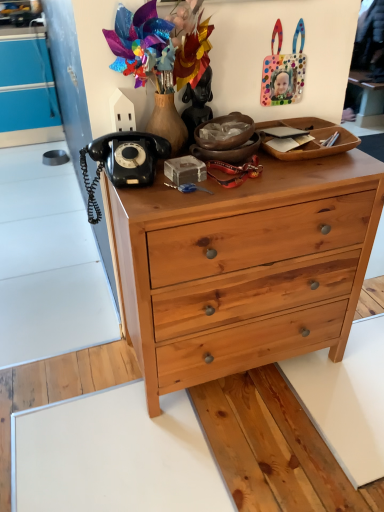
This screenshot has width=384, height=512. Identify the location of black matte statue at upper center. (198, 103).

This screenshot has width=384, height=512. What do you see at coordinates (244, 267) in the screenshot?
I see `natural wood chest of drawers at center` at bounding box center [244, 267].

At what (x,y) coordinates should I click in order to perform the action: click on black matte statue at upper center. Please return your answer as a coordinate pair (x, y). Looking at the image, I should click on (198, 103).

Considering the positions of objects polka dot plastic handbag at upper right and black rubberized telephone at upper left in the image provided, who is behind, polka dot plastic handbag at upper right or black rubberized telephone at upper left?

polka dot plastic handbag at upper right is further from the camera.

The width and height of the screenshot is (384, 512). Find the location of `handbag behind the black rubberized telephone at upper left`. handbag behind the black rubberized telephone at upper left is located at coordinates (283, 70).

From the image's perspective, is polka dot plastic handbag at upper right positioned above or below black rubberized telephone at upper left?

Clearly, from the image's perspective, polka dot plastic handbag at upper right is above black rubberized telephone at upper left.

Does polka dot plastic handbag at upper right have a smaller size compared to natural wood chest of drawers at center?

Yes, polka dot plastic handbag at upper right is smaller than natural wood chest of drawers at center.

Does polka dot plastic handbag at upper right have a greater width compared to natural wood chest of drawers at center?

No.

Is polka dot plastic handbag at upper right to the right of natural wood chest of drawers at center from the viewer's perspective?

Indeed, polka dot plastic handbag at upper right is positioned on the right side of natural wood chest of drawers at center.

Is natural wood chest of drawers at center completely or partially inside polka dot plastic handbag at upper right?

No, natural wood chest of drawers at center is not a part of polka dot plastic handbag at upper right.

Locate an element on the screen. This screenshot has width=384, height=512. person behind the natural wood chest of drawers at center is located at coordinates (198, 103).

From the picture: How many degrees apart are the facing directions of natural wood chest of drawers at center and black matte statue at upper center?

0.818 degrees separate the facing orientations of natural wood chest of drawers at center and black matte statue at upper center.

Which of these two, natural wood chest of drawers at center or black matte statue at upper center, is thinner?

Thinner between the two is black matte statue at upper center.

Considering the positions of objects natural wood chest of drawers at center and black matte statue at upper center in the image provided, who is more to the right, natural wood chest of drawers at center or black matte statue at upper center?

natural wood chest of drawers at center is more to the right.

Is black matte statue at upper center situated inside polka dot plastic handbag at upper right or outside?

black matte statue at upper center is spatially situated outside polka dot plastic handbag at upper right.

Considering the positions of points (190, 87) and (282, 76), is point (190, 87) farther from camera compared to point (282, 76)?

No.

Identify the location of person below the polka dot plastic handbag at upper right (from the image's perspective). (198, 103).

Which is more to the right, black matte statue at upper center or polka dot plastic handbag at upper right?

From the viewer's perspective, polka dot plastic handbag at upper right appears more on the right side.

From the picture: Is the surface of natural wood chest of drawers at center in direct contact with black rubberized telephone at upper left?

No.

From their relative heights in the image, would you say natural wood chest of drawers at center is taller or shorter than black rubberized telephone at upper left?

Considering their sizes, natural wood chest of drawers at center has more height than black rubberized telephone at upper left.

Which of these two, natural wood chest of drawers at center or black rubberized telephone at upper left, is bigger?

With larger size is natural wood chest of drawers at center.

Where is `corded phone above the natural wood chest of drawers at center (from the image's perspective)`? Image resolution: width=384 pixels, height=512 pixels. corded phone above the natural wood chest of drawers at center (from the image's perspective) is located at coordinates (122, 162).

Considering the sizes of objects black rubberized telephone at upper left and black matte statue at upper center in the image provided, who is thinner, black rubberized telephone at upper left or black matte statue at upper center?

With smaller width is black matte statue at upper center.

Locate an element on the screen. This screenshot has width=384, height=512. corded phone below the black matte statue at upper center (from a real-world perspective) is located at coordinates (122, 162).

Is black rubberized telephone at upper left positioned beyond the bounds of black matte statue at upper center?

That's correct, black rubberized telephone at upper left is outside of black matte statue at upper center.

Measure the distance between black rubberized telephone at upper left and black matte statue at upper center.

black rubberized telephone at upper left and black matte statue at upper center are 9.38 inches apart.

Is natural wood chest of drawers at center shorter than polka dot plastic handbag at upper right?

Incorrect, the height of natural wood chest of drawers at center does not fall short of that of polka dot plastic handbag at upper right.

Which object is positioned more to the right, natural wood chest of drawers at center or polka dot plastic handbag at upper right?

Positioned to the right is polka dot plastic handbag at upper right.

Is natural wood chest of drawers at center oriented away from polka dot plastic handbag at upper right?

No, natural wood chest of drawers at center is not facing away from polka dot plastic handbag at upper right.

Looking at this image, from the image's perspective, is natural wood chest of drawers at center located beneath polka dot plastic handbag at upper right?

Yes, from the image's perspective, natural wood chest of drawers at center is beneath polka dot plastic handbag at upper right.

What are the coordinates of `handbag behind the black rubberized telephone at upper left` in the screenshot? It's located at [x=283, y=70].

In the image, there is a natural wood chest of drawers at center. Identify the location of handbag above it (from the image's perspective). The width and height of the screenshot is (384, 512). (283, 70).

Looking at the image, which one is located closer to black rubberized telephone at upper left, polka dot plastic handbag at upper right or natural wood chest of drawers at center?

Among the two, natural wood chest of drawers at center is located nearer to black rubberized telephone at upper left.

Which object lies nearer to the anchor point black matte statue at upper center, polka dot plastic handbag at upper right or natural wood chest of drawers at center?

polka dot plastic handbag at upper right is positioned closer to the anchor black matte statue at upper center.

Based on the photo, when comparing their distances from natural wood chest of drawers at center, does black matte statue at upper center or polka dot plastic handbag at upper right seem closer?

black matte statue at upper center is closer to natural wood chest of drawers at center.

Based on the photo, based on their spatial positions, is black matte statue at upper center or natural wood chest of drawers at center further from polka dot plastic handbag at upper right?

natural wood chest of drawers at center lies further to polka dot plastic handbag at upper right than the other object.

Which object lies nearer to the anchor point black rubberized telephone at upper left, black matte statue at upper center or natural wood chest of drawers at center?

Among the two, black matte statue at upper center is located nearer to black rubberized telephone at upper left.

When comparing their distances from natural wood chest of drawers at center, does polka dot plastic handbag at upper right or black rubberized telephone at upper left seem further?

Based on the image, polka dot plastic handbag at upper right appears to be further to natural wood chest of drawers at center.

When comparing their distances from polka dot plastic handbag at upper right, does natural wood chest of drawers at center or black rubberized telephone at upper left seem further?

natural wood chest of drawers at center is further to polka dot plastic handbag at upper right.

Which object lies further to the anchor point natural wood chest of drawers at center, black rubberized telephone at upper left or polka dot plastic handbag at upper right?

The object further to natural wood chest of drawers at center is polka dot plastic handbag at upper right.

At what (x,y) coordinates should I click in order to perform the action: click on person between polka dot plastic handbag at upper right and natural wood chest of drawers at center in the up-down direction. Please return your answer as a coordinate pair (x, y). This screenshot has width=384, height=512. Looking at the image, I should click on (198, 103).

Find the location of a particular element. Image resolution: width=384 pixels, height=512 pixels. corded phone between black matte statue at upper center and natural wood chest of drawers at center from top to bottom is located at coordinates (122, 162).

You are a GUI agent. You are given a task and a screenshot of the screen. Output one action in this format:
    pyautogui.click(x=<x>, y=<y>)
    Task: Click on the person located between black rubberized telephone at upper left and polka dot plastic handbag at upper right in the left-right direction
    This screenshot has height=512, width=384.
    Given the screenshot: What is the action you would take?
    pyautogui.click(x=198, y=103)

This screenshot has width=384, height=512. I want to click on corded phone that lies between polka dot plastic handbag at upper right and natural wood chest of drawers at center from top to bottom, so click(122, 162).